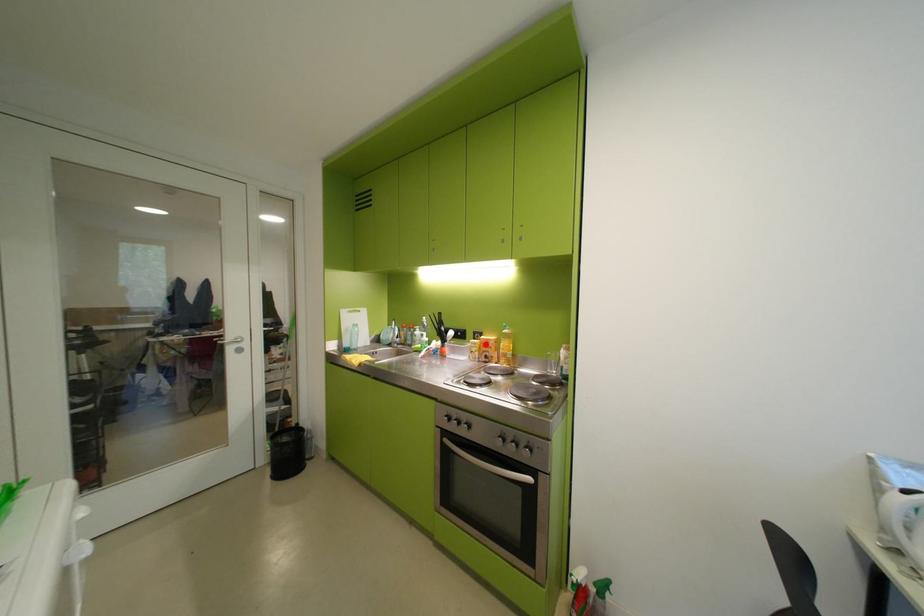
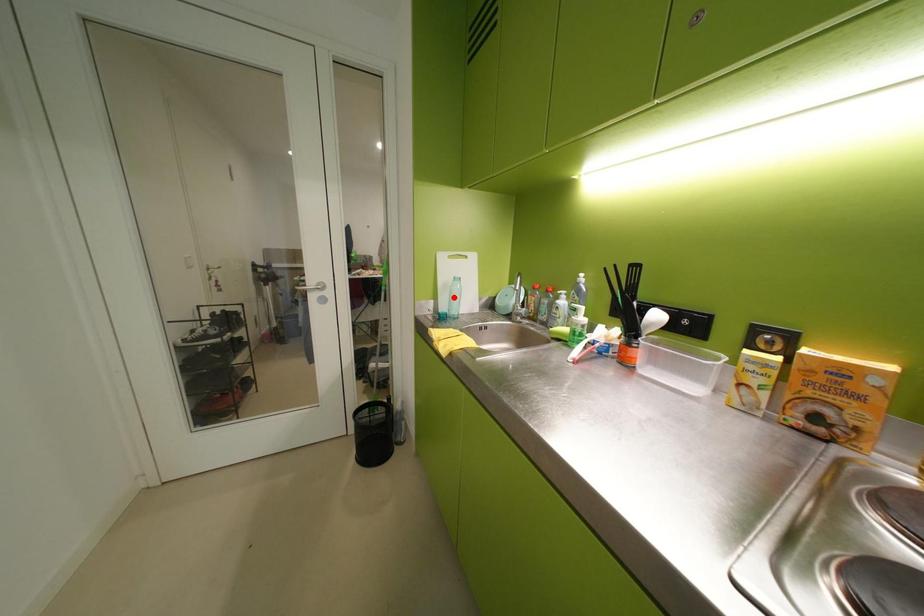
I am providing you with two images of the same scene from different viewpoints. A red point is marked on the first image and another point is marked on the second image. Is the red point in image1 aligned with the point shown in image2?

No